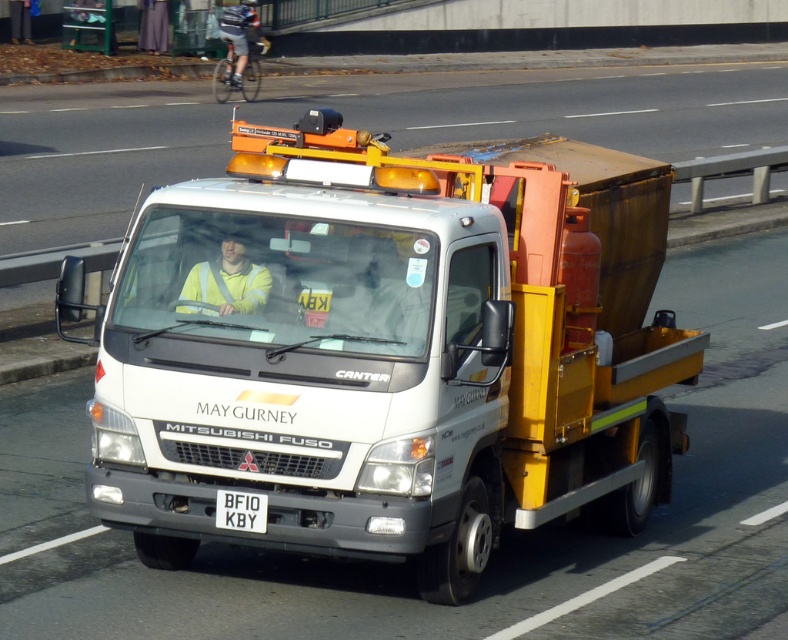
You are a safety inspector checking the vehicle. The white matte truck at center and the yellow reflective vest at center are both in your line of sight. Which object is bigger in size?

The white matte truck at center is larger in size compared to the yellow reflective vest at center.

Consider the image. You are a pedestrian standing on the sidewalk. You see the white matte truck at center and the yellow reflective vest at center. Which object is higher from the ground?

The yellow reflective vest at center is higher than the white matte truck at center because the white matte truck at center is below it.